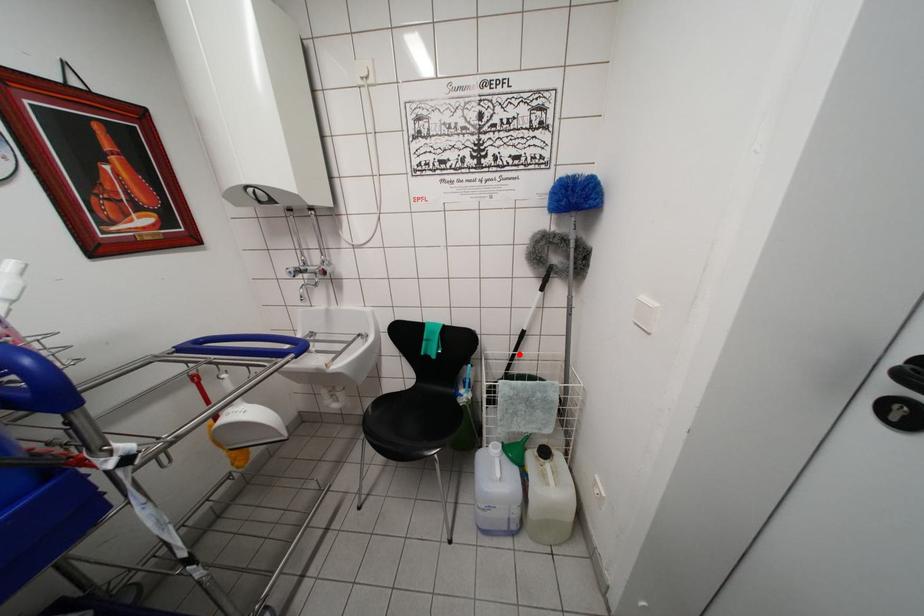
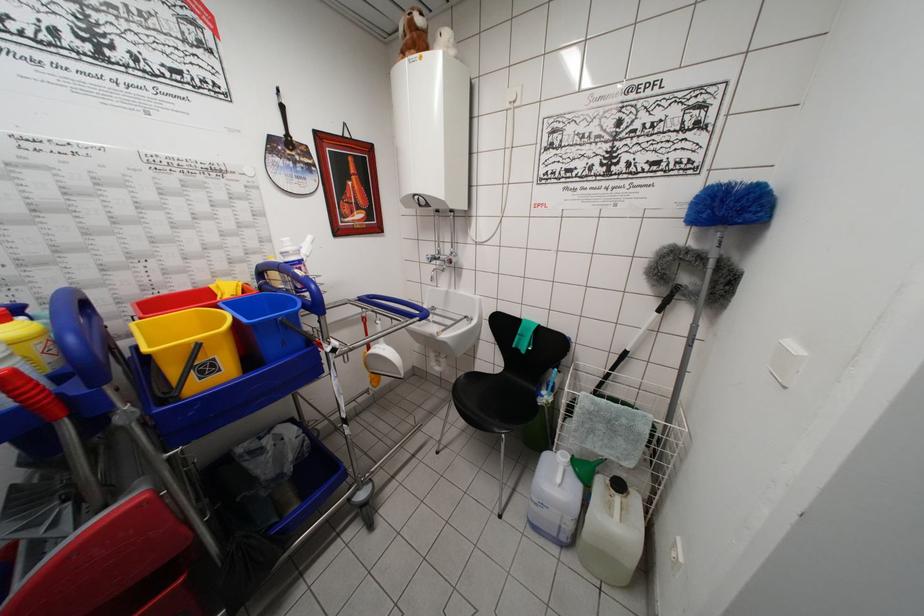
Find the pixel in the second image that matches the highlighted location in the first image.

(616, 374)